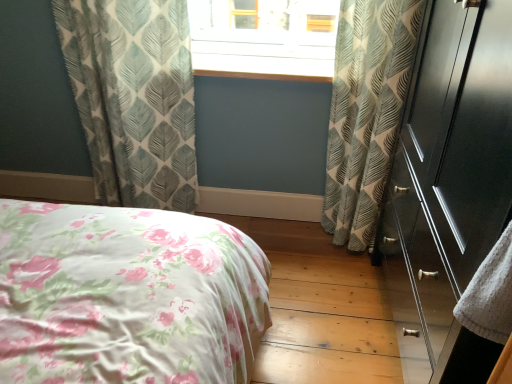
Question: From a real-world perspective, is leaf-patterned fabric curtain at right, the 2th curtain from the left, on glossy dark wood dresser at right?

Choices:
 (A) yes
 (B) no

Answer: (B)

Question: Is leaf-patterned fabric curtain at right, the 2th curtain from the left, outside of glossy dark wood dresser at right?

Choices:
 (A) yes
 (B) no

Answer: (A)

Question: Does leaf-patterned fabric curtain at right, the 2th curtain from the left, turn towards glossy dark wood dresser at right?

Choices:
 (A) yes
 (B) no

Answer: (A)

Question: Can glossy dark wood dresser at right be found inside leaf-patterned fabric curtain at right, the 2th curtain from the left?

Choices:
 (A) no
 (B) yes

Answer: (A)

Question: Considering the relative sizes of leaf-patterned fabric curtain at right, the 2th curtain from the left, and glossy dark wood dresser at right in the image provided, is leaf-patterned fabric curtain at right, the 2th curtain from the left, wider than glossy dark wood dresser at right?

Choices:
 (A) no
 (B) yes

Answer: (A)

Question: Is leaf-patterned fabric curtain at right, the 2th curtain from the left, positioned far away from glossy dark wood dresser at right?

Choices:
 (A) yes
 (B) no

Answer: (B)

Question: Would you consider light blue textured curtains at upper left, acting as the 1th curtain starting from the left, to be distant from leaf-patterned fabric curtain at right, the 2th curtain from the left?

Choices:
 (A) no
 (B) yes

Answer: (A)

Question: Is light blue textured curtains at upper left, acting as the 1th curtain starting from the left, at the left side of leaf-patterned fabric curtain at right, positioned as the 1th curtain in right-to-left order?

Choices:
 (A) yes
 (B) no

Answer: (A)

Question: From a real-world perspective, does light blue textured curtains at upper left, marked as the second curtain in a right-to-left arrangement, sit lower than leaf-patterned fabric curtain at right, the 2th curtain from the left?

Choices:
 (A) no
 (B) yes

Answer: (B)

Question: Is the surface of light blue textured curtains at upper left, marked as the second curtain in a right-to-left arrangement, in direct contact with leaf-patterned fabric curtain at right, the 2th curtain from the left?

Choices:
 (A) no
 (B) yes

Answer: (A)

Question: Does light blue textured curtains at upper left, marked as the second curtain in a right-to-left arrangement, have a smaller size compared to leaf-patterned fabric curtain at right, the 2th curtain from the left?

Choices:
 (A) yes
 (B) no

Answer: (B)

Question: Does light blue textured curtains at upper left, acting as the 1th curtain starting from the left, appear on the right side of leaf-patterned fabric curtain at right, positioned as the 1th curtain in right-to-left order?

Choices:
 (A) yes
 (B) no

Answer: (B)

Question: Does light blue textured curtains at upper left, acting as the 1th curtain starting from the left, come in front of wooden at center?

Choices:
 (A) no
 (B) yes

Answer: (B)